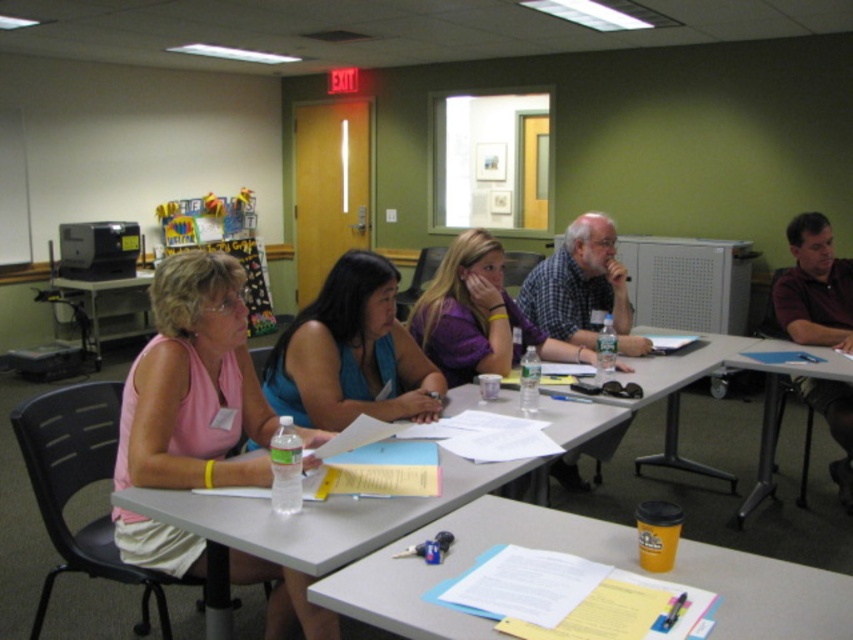
You are organizing a presentation and need to place a name tag on the table. The name tag is the size of the white paper at center. Can the name tag fit on the purple fabric shirt at center?

The white paper at center is smaller than the purple fabric shirt at center, so the name tag can fit on the purple fabric shirt at center.

You are standing in the conference room and see two points marked in the image. Which point is closer to you, point (811,593) or point (811,256)?

Point (811,593) is closer to the viewer than point (811,256).